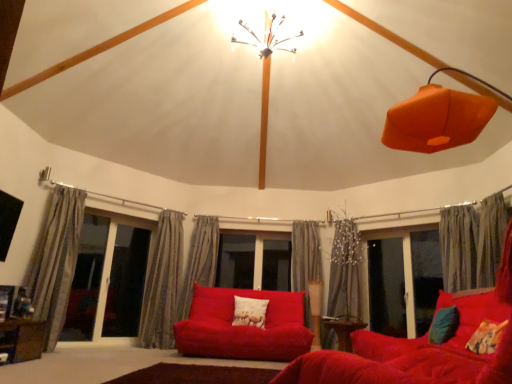
Question: From the image's perspective, is wooden table at lower center, which appears as the first table when viewed from the back, positioned above or below gray textured curtain at center, which is the 4th curtain in right-to-left order?

Choices:
 (A) above
 (B) below

Answer: (B)

Question: In the image, is wooden table at lower center, which is the second table from front to back, positioned in front of or behind gray textured curtain at center, which is counted as the 4th curtain, starting from the left?

Choices:
 (A) front
 (B) behind

Answer: (A)

Question: Which object is positioned farthest from the transparent glass window at right?

Choices:
 (A) matte red couch at center, acting as the 2th studio couch starting from the right
 (B) brown rug at lower center
 (C) velvet red sofa at lower right, the 1th studio couch positioned from the right
 (D) gray textured curtain at right, which is the 6th curtain in left-to-right order
 (E) transparent glass screen door at left, the first screen door from the left

Answer: (E)

Question: Estimate the real-world distances between objects in this image. Which object is closer to the matte red couch at center, acting as the 2th studio couch starting from the right?

Choices:
 (A) wooden table at lower center, which is the second table from front to back
 (B) gray textured curtain at center, which is counted as the 4th curtain, starting from the left
 (C) teal fabric pillow at lower right, arranged as the first pillow when viewed from the right
 (D) metallic wire chandelier at upper center
 (E) gray textured curtain at center, the 3th curtain when ordered from right to left

Answer: (B)